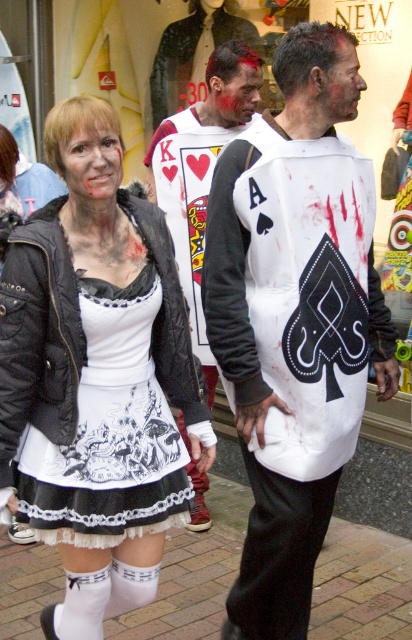
Question: Which object appears farthest from the camera in this image?

Choices:
 (A) white printed fabric dress at center
 (B) white matte dress at center
 (C) white matte vest at center
 (D) white jersey at center

Answer: (D)

Question: Does white matte vest at center appear on the left side of white printed fabric dress at center?

Choices:
 (A) yes
 (B) no

Answer: (B)

Question: Among these points, which one is farthest from the camera?

Choices:
 (A) (75, 488)
 (B) (147, 273)
 (C) (273, 246)
 (D) (187, 468)

Answer: (D)

Question: Is white matte dress at center bigger than white printed fabric dress at center?

Choices:
 (A) yes
 (B) no

Answer: (A)

Question: Is white matte vest at center bigger than white printed fabric dress at center?

Choices:
 (A) no
 (B) yes

Answer: (B)

Question: Which object is closer to the camera taking this photo?

Choices:
 (A) white jersey at center
 (B) white matte dress at center

Answer: (B)